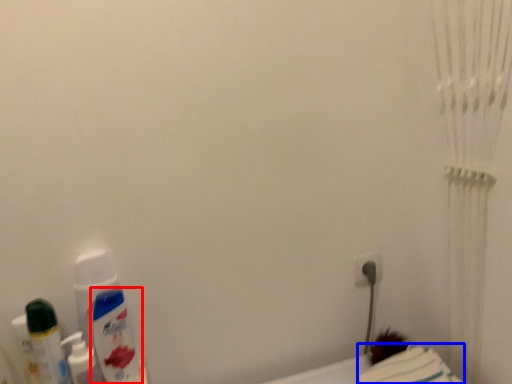
Question: Which point is closer to the camera, mouthwash (highlighted by a red box) or sheet (highlighted by a blue box)?

Choices:
 (A) mouthwash
 (B) sheet

Answer: (B)